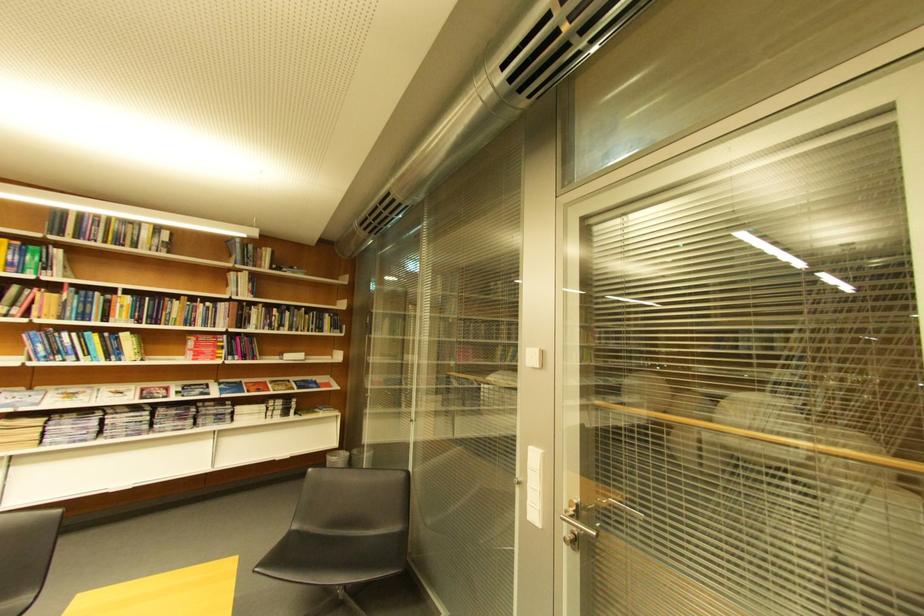
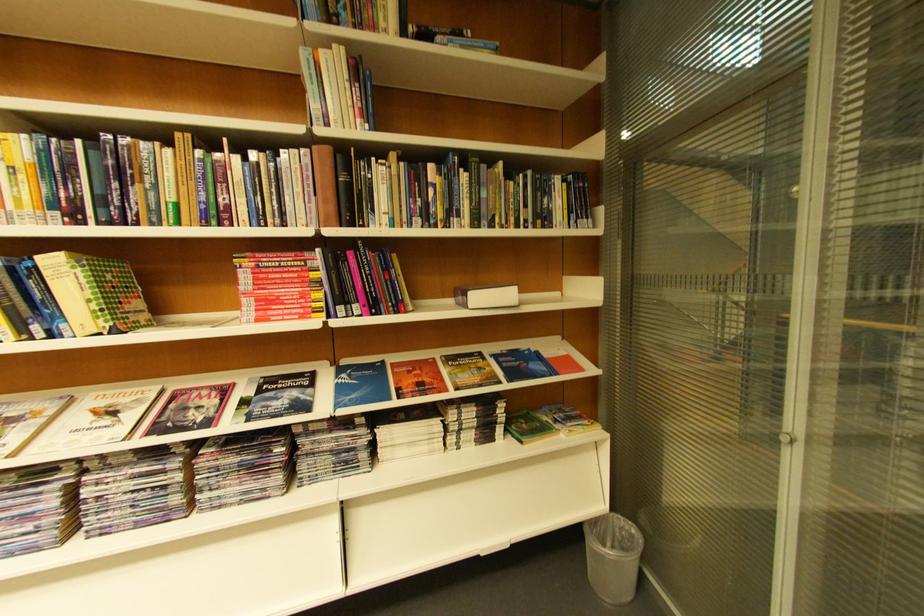
Where in the second image is the point corresponding to point (247, 359) from the first image?

(367, 310)